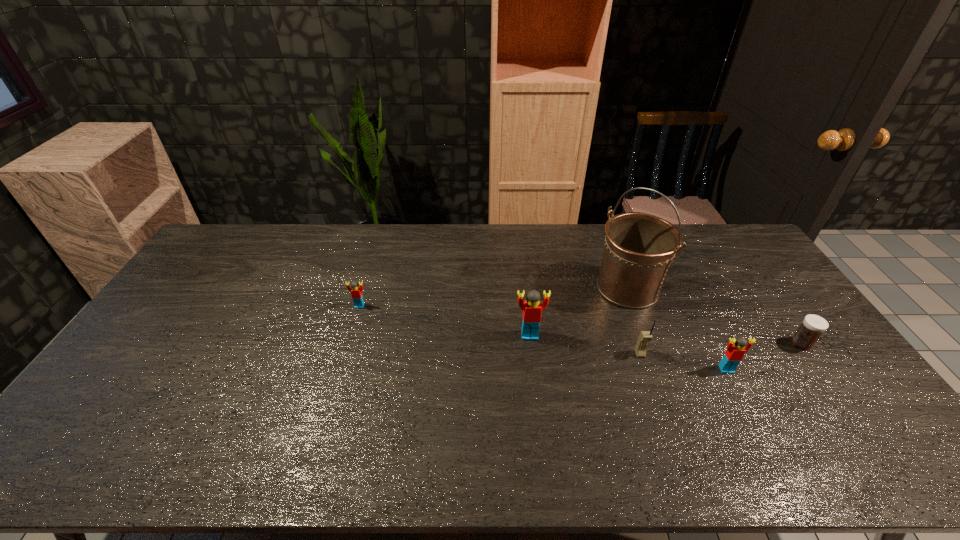
The width and height of the screenshot is (960, 540). Find the location of `free space located on the face of the second nearest Lego`. free space located on the face of the second nearest Lego is located at coordinates (534, 374).

Locate an element on the screen. The width and height of the screenshot is (960, 540). vacant area situated on the face of the rightmost Lego is located at coordinates (751, 416).

The width and height of the screenshot is (960, 540). Identify the location of free space located on the back of the tallest object. (615, 255).

Find the location of a particular element. The height and width of the screenshot is (540, 960). vacant space situated on the back of the rightmost object is located at coordinates click(x=756, y=279).

I want to click on free space located 0.190m on the front of the cellular telephone, where the keypad is located, so click(x=662, y=418).

Find the location of a particular element. object present at the right edge is located at coordinates [x=813, y=326].

In the image, there is a desktop. Where is `vacant area at the far edge`? The width and height of the screenshot is (960, 540). vacant area at the far edge is located at coordinates (272, 230).

This screenshot has width=960, height=540. In order to click on vacant space at the near edge of the desktop in this screenshot , I will do `click(445, 411)`.

This screenshot has height=540, width=960. In order to click on free region at the left edge of the desktop in this screenshot , I will do `click(164, 350)`.

Find the location of a particular element. free location at the right edge of the desktop is located at coordinates (822, 352).